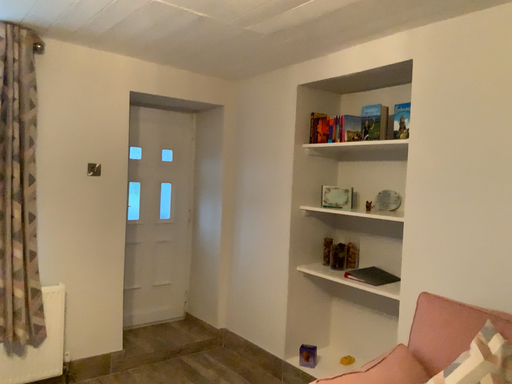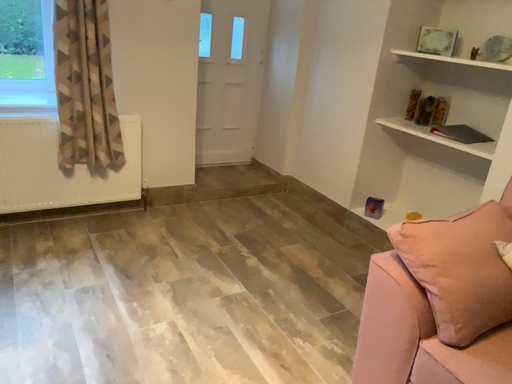
Question: Which way did the camera rotate in the video?

Choices:
 (A) rotated right
 (B) rotated left

Answer: (B)